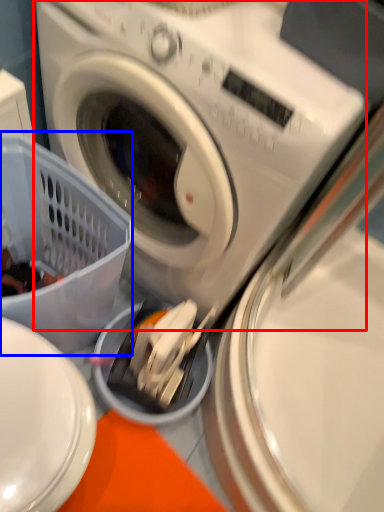
Question: Which object appears farthest to the camera in this image, washing machine (highlighted by a red box) or basket (highlighted by a blue box)?

Choices:
 (A) washing machine
 (B) basket

Answer: (B)